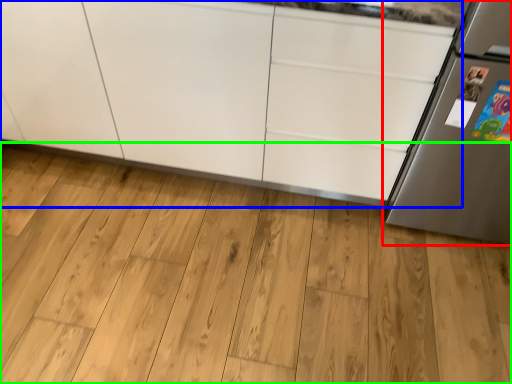
Question: Based on their relative distances, which object is farther from refrigerator (highlighted by a red box)? Choose from cabinetry (highlighted by a blue box) and hardwood (highlighted by a green box).

Choices:
 (A) cabinetry
 (B) hardwood

Answer: (B)